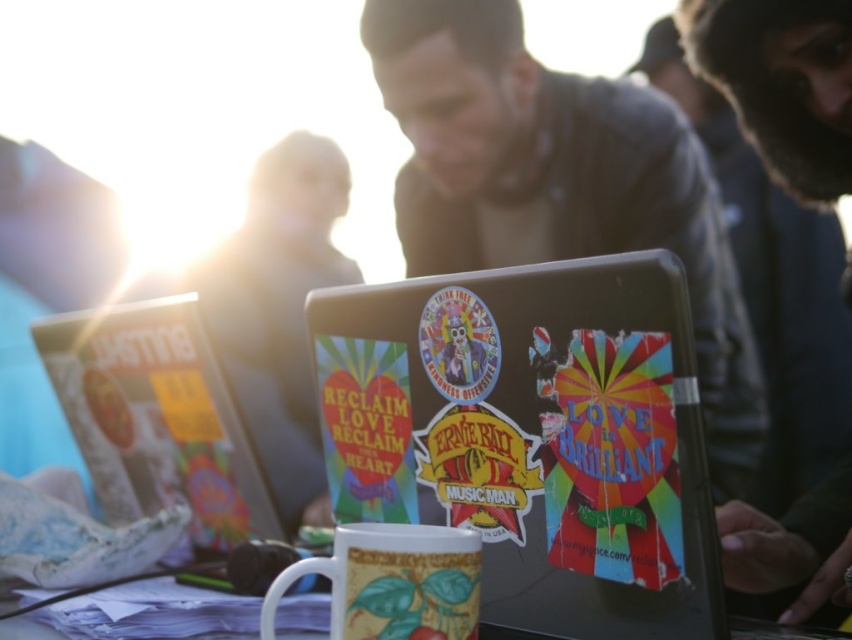
Question: Which object is the farthest from the matte black laptop at center?

Choices:
 (A) white glossy mug at center
 (B) white glossy mug at lower center
 (C) multicolored stickered laptop at center

Answer: (A)

Question: Does multicolored stickered laptop at center have a lesser width compared to white glossy mug at lower center?

Choices:
 (A) no
 (B) yes

Answer: (A)

Question: Is multicolored stickered laptop at center bigger than matte black laptop at center?

Choices:
 (A) yes
 (B) no

Answer: (B)

Question: Which object is positioned farthest from the multicolored stickered laptop at center?

Choices:
 (A) matte black laptop at center
 (B) white glossy mug at lower center

Answer: (A)

Question: Which object appears closest to the camera in this image?

Choices:
 (A) white glossy mug at center
 (B) white glossy mug at lower center

Answer: (A)

Question: Can you confirm if white glossy mug at center is positioned above white glossy mug at lower center?

Choices:
 (A) no
 (B) yes

Answer: (B)